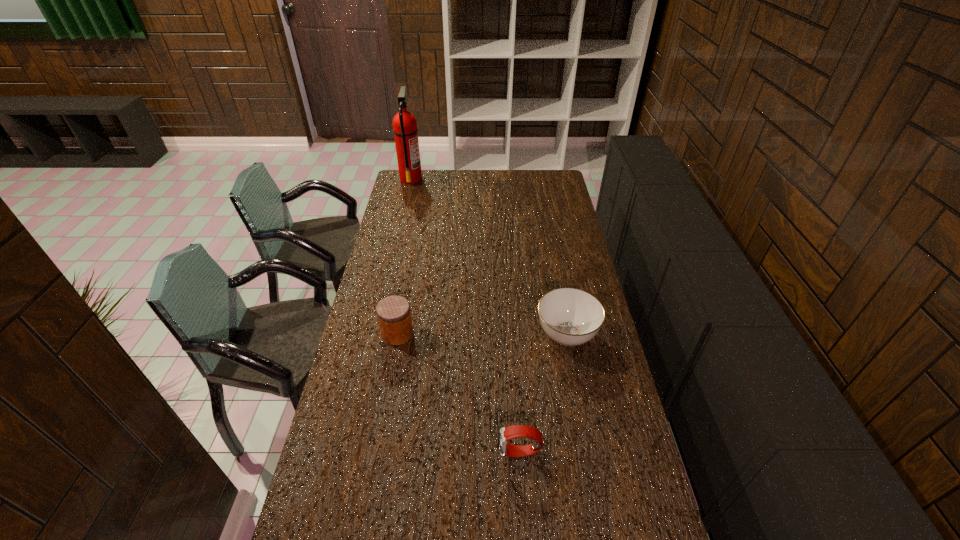
The image size is (960, 540). What are the coordinates of `free space located on the face of the watch` in the screenshot? It's located at (461, 453).

Identify the location of free location located on the face of the watch. (444, 453).

Find the location of a particular element. The height and width of the screenshot is (540, 960). object that is at the far edge is located at coordinates (405, 129).

At what (x,y) coordinates should I click in order to perform the action: click on fire extinguisher positioned at the left edge. Please return your answer as a coordinate pair (x, y). Looking at the image, I should click on (405, 129).

You are a GUI agent. You are given a task and a screenshot of the screen. Output one action in this format:
    pyautogui.click(x=<x>, y=<y>)
    Task: Click on the jar positioned at the left edge
    
    Given the screenshot: What is the action you would take?
    pyautogui.click(x=394, y=316)

I want to click on object that is at the right edge, so click(x=569, y=316).

Locate an element on the screen. This screenshot has height=540, width=960. object that is at the far left corner is located at coordinates (405, 129).

Locate an element on the screen. This screenshot has height=540, width=960. blank space at the far edge of the desktop is located at coordinates (432, 186).

The width and height of the screenshot is (960, 540). What are the coordinates of `vacant space at the left edge` in the screenshot? It's located at (391, 267).

In the image, there is a desktop. At what (x,y) coordinates should I click in order to perform the action: click on vacant space at the right edge. Please return your answer as a coordinate pair (x, y). The image size is (960, 540). Looking at the image, I should click on (561, 254).